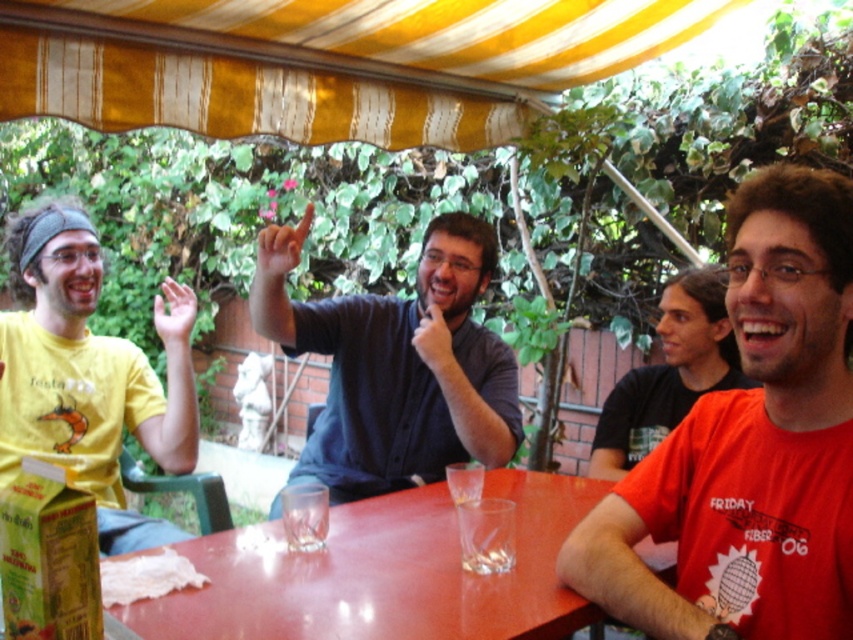
Can you confirm if yellow t-shirt at left is positioned to the left of flesh-toned skin finger at center?

Indeed, yellow t-shirt at left is positioned on the left side of flesh-toned skin finger at center.

Does yellow t-shirt at left appear on the right side of flesh-toned skin finger at center?

No, yellow t-shirt at left is not to the right of flesh-toned skin finger at center.

The image size is (853, 640). What do you see at coordinates (84, 376) in the screenshot?
I see `yellow t-shirt at left` at bounding box center [84, 376].

You are a GUI agent. You are given a task and a screenshot of the screen. Output one action in this format:
    pyautogui.click(x=<x>, y=<y>)
    Task: Click on the yellow t-shirt at left
    
    Given the screenshot: What is the action you would take?
    pos(84,376)

Is yellow t-shirt at left below smooth skin hand at upper left?

Correct, yellow t-shirt at left is located below smooth skin hand at upper left.

Is point (158, 454) more distant than point (173, 362)?

Yes, point (158, 454) is farther from viewer.

I want to click on yellow t-shirt at left, so click(84, 376).

Can you confirm if red matte shirt at right is positioned above flesh-toned skin finger at center?

No, red matte shirt at right is not above flesh-toned skin finger at center.

Between red matte shirt at right and flesh-toned skin finger at center, which one is positioned lower?

Positioned lower is red matte shirt at right.

Image resolution: width=853 pixels, height=640 pixels. Describe the element at coordinates (750, 445) in the screenshot. I see `red matte shirt at right` at that location.

The image size is (853, 640). In order to click on red matte shirt at right in this screenshot , I will do `click(750, 445)`.